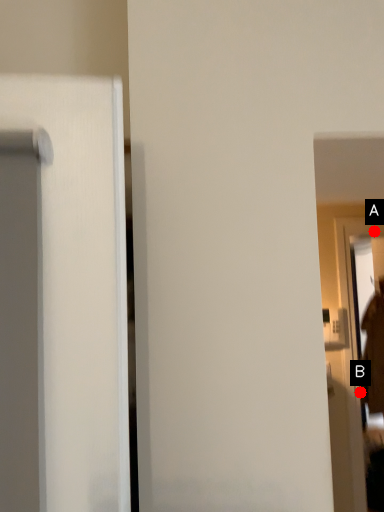
Question: Two points are circled on the image, labeled by A and B beside each circle. Which point is farther from the camera taking this photo?

Choices:
 (A) A is further
 (B) B is further

Answer: (A)